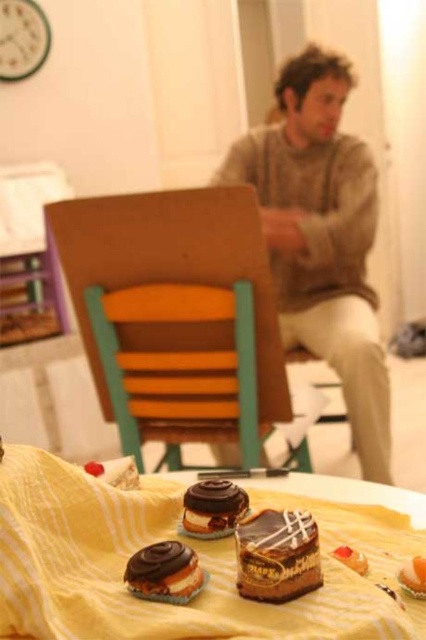
Between wooden chair at center and yellow fabric tablecloth at lower center, which one has less height?

Standing shorter between the two is yellow fabric tablecloth at lower center.

I want to click on wooden chair at center, so click(175, 314).

You are a GUI agent. You are given a task and a screenshot of the screen. Output one action in this format:
    pyautogui.click(x=<x>, y=<y>)
    Task: Click on the wooden chair at center
    
    Given the screenshot: What is the action you would take?
    pyautogui.click(x=175, y=314)

Which is more to the right, wooden chair at center or chocolate frosted cupcake at center?

From the viewer's perspective, chocolate frosted cupcake at center appears more on the right side.

Can you confirm if wooden chair at center is shorter than chocolate frosted cupcake at center?

Incorrect, wooden chair at center's height does not fall short of chocolate frosted cupcake at center's.

Is point (100, 301) positioned before point (417, 556)?

No.

Locate an element on the screen. This screenshot has height=640, width=426. wooden chair at center is located at coordinates (x=175, y=314).

Where is `brown knitted sweater at upper center`? brown knitted sweater at upper center is located at coordinates (322, 237).

Does brown knitted sweater at upper center have a smaller size compared to chocolate frosted cupcake at center?

Incorrect, brown knitted sweater at upper center is not smaller in size than chocolate frosted cupcake at center.

Is point (374, 442) positioned before point (423, 563)?

That is False.

Where is `brown knitted sweater at upper center`? brown knitted sweater at upper center is located at coordinates (322, 237).